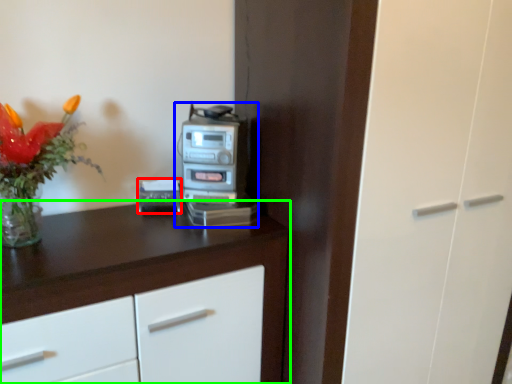
Question: Based on their relative distances, which object is farther from appliance (highlighted by a red box)? Choose from home appliance (highlighted by a blue box) and cabinetry (highlighted by a green box).

Choices:
 (A) home appliance
 (B) cabinetry

Answer: (B)